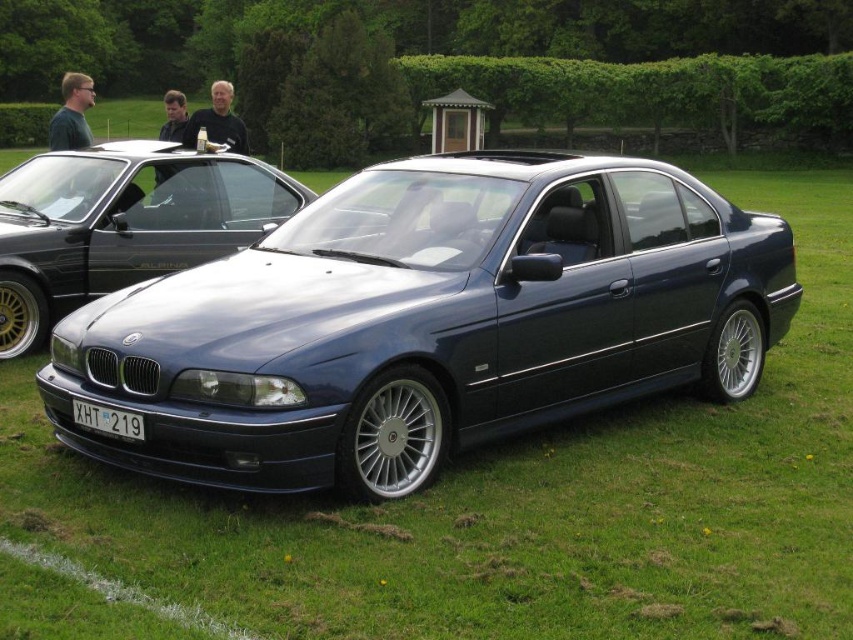
Question: Which object appears farthest from the camera in this image?

Choices:
 (A) black plastic license plate at center
 (B) metallic blue sedan at center

Answer: (A)

Question: Can you confirm if metallic blue sedan at center is positioned below black plastic license plate at center?

Choices:
 (A) yes
 (B) no

Answer: (B)

Question: Does metallic blue sedan at center have a larger size compared to satin blue car at center?

Choices:
 (A) no
 (B) yes

Answer: (B)

Question: Which object is farther from the camera taking this photo?

Choices:
 (A) metallic blue sedan at center
 (B) black plastic license plate at center
 (C) satin blue car at center

Answer: (C)

Question: Can you confirm if metallic blue sedan at center is thinner than black plastic license plate at center?

Choices:
 (A) no
 (B) yes

Answer: (A)

Question: Which of these objects is positioned closest to the metallic blue sedan at center?

Choices:
 (A) black plastic license plate at center
 (B) satin blue car at center

Answer: (A)